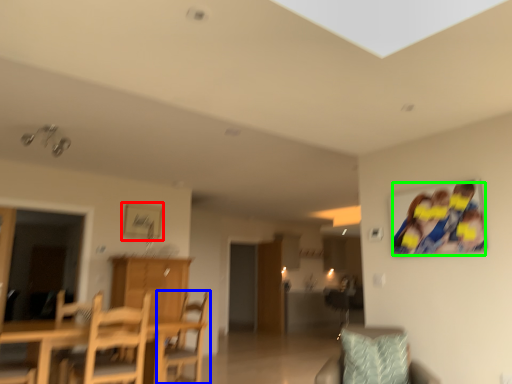
Question: Which is nearer to the picture frame (highlighted by a red box)? chair (highlighted by a blue box) or couple (highlighted by a green box).

Choices:
 (A) chair
 (B) couple

Answer: (A)